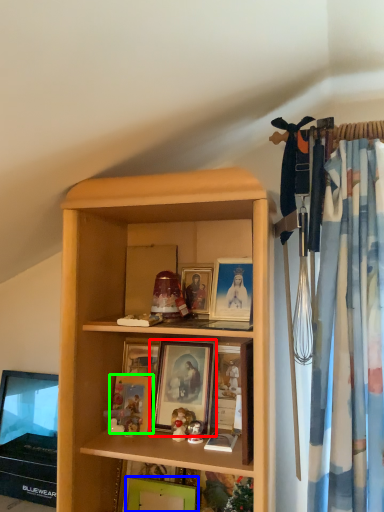
Question: Which is farther away from picture frame (highlighted by a red box)? picture frame (highlighted by a blue box) or picture frame (highlighted by a green box)?

Choices:
 (A) picture frame
 (B) picture frame

Answer: (A)